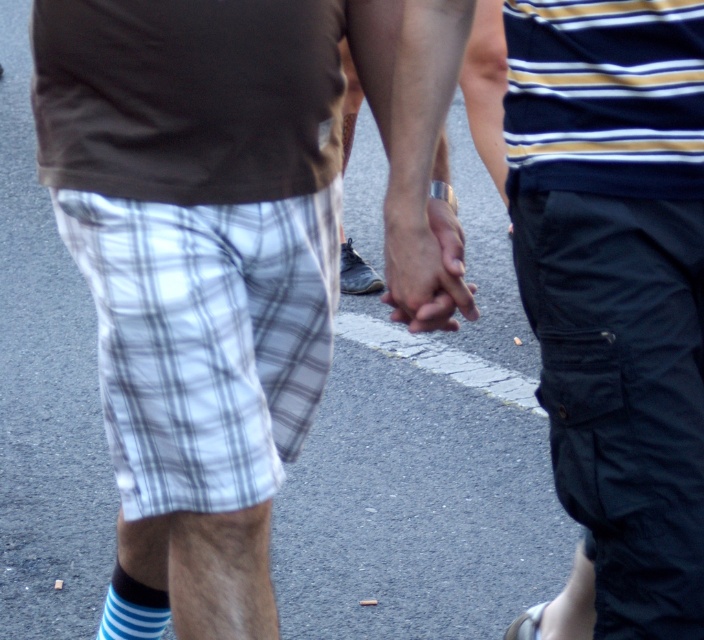
You are a fashion designer observing two items in the image. The items are the white plaid shorts at lower left and the striped cotton sock at lower left. Which item has a larger size?

The white plaid shorts at lower left is bigger than striped cotton sock at lower left, so the white plaid shorts at lower left has a larger size.

You are a photographer trying to capture the white plaid shorts at lower left and the striped cotton sock at lower left in a single frame. Which object should you focus on first to ensure both are in the frame?

The white plaid shorts at lower left is located above the striped cotton sock at lower left, so you should focus on the white plaid shorts at lower left first to ensure both are in the frame.

You are a fashion designer analyzing the image. You notice two pairs of white plaid shorts at center and white plaid shorts at lower left. Which one is positioned to the right side of the other?

The white plaid shorts at center is positioned to the right of the white plaid shorts at lower left.